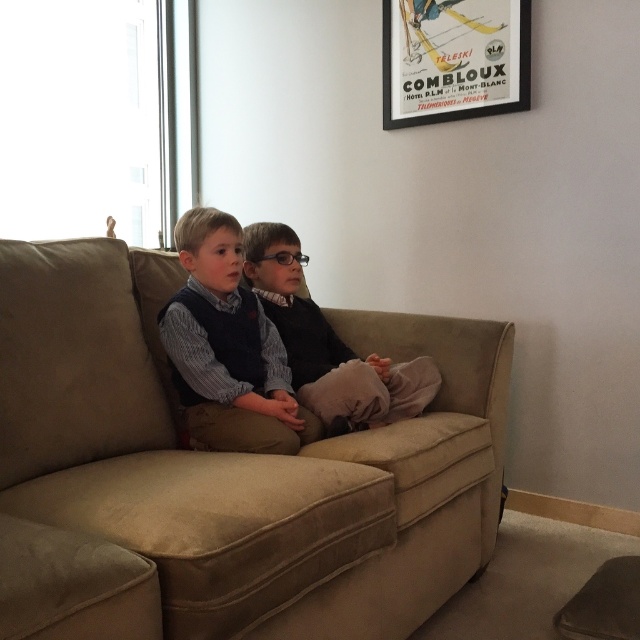
Question: Among these points, which one is farthest from the camera?

Choices:
 (A) (326, 579)
 (B) (250, 369)
 (C) (440, 67)

Answer: (C)

Question: Is beige fabric couch at center thinner than matte black poster at upper center?

Choices:
 (A) yes
 (B) no

Answer: (B)

Question: Which of these objects is positioned farthest from the matte black sweater at center?

Choices:
 (A) matte black poster at upper center
 (B) matte blue shirt at center

Answer: (A)

Question: Which point appears closest to the camera in this image?

Choices:
 (A) (141, 388)
 (B) (449, 83)
 (C) (173, 326)

Answer: (A)

Question: Does matte blue shirt at center have a smaller size compared to matte black sweater at center?

Choices:
 (A) no
 (B) yes

Answer: (B)

Question: Does beige fabric couch at center have a lesser width compared to matte black sweater at center?

Choices:
 (A) no
 (B) yes

Answer: (A)